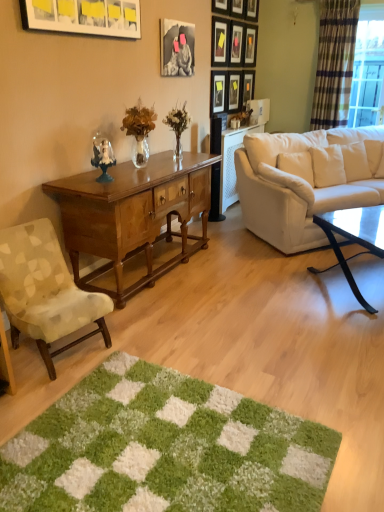
Question: Is matte white picture frame at upper left, the eleventh picture frame when ordered from right to left, positioned beyond the bounds of wooden picture frame at upper center, the 8th picture frame when ordered from right to left?

Choices:
 (A) no
 (B) yes

Answer: (B)

Question: Can you confirm if matte white picture frame at upper left, the eleventh picture frame when ordered from right to left, is positioned to the left of wooden picture frame at upper center, marked as the fourth picture frame in a left-to-right arrangement?

Choices:
 (A) no
 (B) yes

Answer: (B)

Question: From the image's perspective, is matte white picture frame at upper left, the eleventh picture frame when ordered from right to left, beneath wooden picture frame at upper center, the 8th picture frame when ordered from right to left?

Choices:
 (A) no
 (B) yes

Answer: (B)

Question: Is matte white picture frame at upper left, the 1th picture frame from the left, closer to the viewer compared to wooden picture frame at upper center, marked as the fourth picture frame in a left-to-right arrangement?

Choices:
 (A) no
 (B) yes

Answer: (B)

Question: Can you confirm if matte white picture frame at upper left, the 1th picture frame from the left, is positioned to the right of wooden picture frame at upper center, the 8th picture frame when ordered from right to left?

Choices:
 (A) yes
 (B) no

Answer: (B)

Question: From the image's perspective, is green shaggy rug at lower center located above or below wooden picture frame at upper center, which is the third picture frame from right to left?

Choices:
 (A) above
 (B) below

Answer: (B)

Question: Considering the positions of green shaggy rug at lower center and wooden picture frame at upper center, which is the third picture frame from right to left, in the image, is green shaggy rug at lower center wider or thinner than wooden picture frame at upper center, which is the third picture frame from right to left,?

Choices:
 (A) thin
 (B) wide

Answer: (B)

Question: From their relative heights in the image, would you say green shaggy rug at lower center is taller or shorter than wooden picture frame at upper center, placed as the ninth picture frame when sorted from left to right?

Choices:
 (A) short
 (B) tall

Answer: (A)

Question: Is green shaggy rug at lower center in front of or behind wooden picture frame at upper center, which is the third picture frame from right to left, in the image?

Choices:
 (A) front
 (B) behind

Answer: (A)

Question: Which is correct: wooden picture frame at upper center, acting as the fifth picture frame starting from the left, is inside wooden picture frame at upper center, the 8th picture frame when ordered from right to left, or outside of it?

Choices:
 (A) inside
 (B) outside

Answer: (B)

Question: Based on their positions, is wooden picture frame at upper center, arranged as the 7th picture frame when viewed from the right, located to the left or right of wooden picture frame at upper center, marked as the fourth picture frame in a left-to-right arrangement?

Choices:
 (A) right
 (B) left

Answer: (A)

Question: From the image's perspective, relative to wooden picture frame at upper center, the 8th picture frame when ordered from right to left, is wooden picture frame at upper center, acting as the fifth picture frame starting from the left, above or below?

Choices:
 (A) above
 (B) below

Answer: (A)

Question: Considering the positions of wooden picture frame at upper center, acting as the fifth picture frame starting from the left, and wooden picture frame at upper center, the 8th picture frame when ordered from right to left, in the image, is wooden picture frame at upper center, acting as the fifth picture frame starting from the left, wider or thinner than wooden picture frame at upper center, the 8th picture frame when ordered from right to left,?

Choices:
 (A) wide
 (B) thin

Answer: (A)

Question: Based on their sizes in the image, would you say wooden picture frame at upper center, acting as the fifth picture frame starting from the left, is bigger or smaller than green shaggy rug at lower center?

Choices:
 (A) small
 (B) big

Answer: (A)

Question: Is point (221, 6) closer or farther from the camera than point (261, 480)?

Choices:
 (A) farther
 (B) closer

Answer: (A)